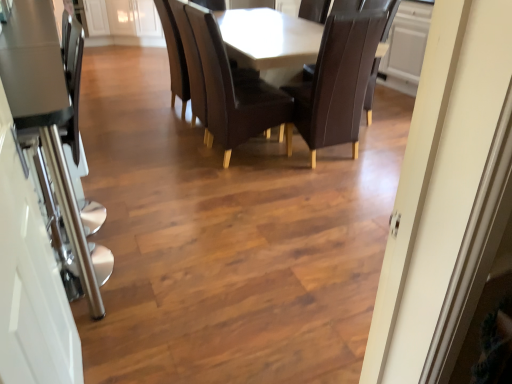
Describe the element at coordinates (233, 90) in the screenshot. I see `leather at center, the first chair positioned from the left` at that location.

This screenshot has height=384, width=512. Find the location of `clear glass door at left`. clear glass door at left is located at coordinates click(x=31, y=288).

Does leather at center, the first chair positioned from the left, turn towards clear glass door at left?

No, leather at center, the first chair positioned from the left, is not turned towards clear glass door at left.

Considering their positions, is leather at center, which is counted as the second chair, starting from the right, located in front of or behind clear glass door at left?

In the image, leather at center, which is counted as the second chair, starting from the right, appears behind clear glass door at left.

From a real-world perspective, is leather at center, the first chair positioned from the left, beneath clear glass door at left?

Yes.

Based on the photo, can you tell me how much leather at center, which is counted as the second chair, starting from the right, and clear glass door at left differ in facing direction?

They differ by 3.49 degrees in their facing directions.

From the image's perspective, which one is positioned lower, leather at center, which is counted as the second chair, starting from the right, or matte brown table at center?

From the image's view, leather at center, which is counted as the second chair, starting from the right, is below.

Consider the image. Which is more to the right, leather at center, the first chair positioned from the left, or matte brown table at center?

matte brown table at center.

Is point (268, 114) positioned after point (278, 109)?

No, (268, 114) is in front of (278, 109).

Is clear glass door at left smaller than leather at center, which is counted as the second chair, starting from the right?

Indeed, clear glass door at left has a smaller size compared to leather at center, which is counted as the second chair, starting from the right.

Does point (9, 263) come closer to viewer compared to point (214, 21)?

Yes, it is.

From a real-world perspective, who is located higher, clear glass door at left or leather at center, which is counted as the second chair, starting from the right?

clear glass door at left.

In the scene shown: Can you see clear glass door at left touching leather at center, the first chair positioned from the left?

There is a gap between clear glass door at left and leather at center, the first chair positioned from the left.

Consider the image. Considering the sizes of objects dark brown leather chair at center, which ranks as the second chair in left-to-right order, and leather at center, the first chair positioned from the left, in the image provided, who is wider, dark brown leather chair at center, which ranks as the second chair in left-to-right order, or leather at center, the first chair positioned from the left,?

leather at center, the first chair positioned from the left, is wider.

I want to click on chair below the dark brown leather chair at center, which appears as the first chair when viewed from the right (from the image's perspective), so click(233, 90).

Are dark brown leather chair at center, which ranks as the second chair in left-to-right order, and leather at center, the first chair positioned from the left, far apart?

Actually, dark brown leather chair at center, which ranks as the second chair in left-to-right order, and leather at center, the first chair positioned from the left, are a little close together.

From a real-world perspective, who is located higher, dark brown leather chair at center, which ranks as the second chair in left-to-right order, or leather at center, which is counted as the second chair, starting from the right?

leather at center, which is counted as the second chair, starting from the right, from a real-world perspective.

Is dark brown leather chair at center, which ranks as the second chair in left-to-right order, turned away from matte brown table at center?

Absolutely, dark brown leather chair at center, which ranks as the second chair in left-to-right order, is directed away from matte brown table at center.

Is dark brown leather chair at center, which ranks as the second chair in left-to-right order, located outside matte brown table at center?

No, dark brown leather chair at center, which ranks as the second chair in left-to-right order, is inside or overlapping with matte brown table at center.

From a real-world perspective, is dark brown leather chair at center, which ranks as the second chair in left-to-right order, over matte brown table at center?

Indeed, from a real-world perspective, dark brown leather chair at center, which ranks as the second chair in left-to-right order, stands above matte brown table at center.

From the image's perspective, which one is positioned higher, dark brown leather chair at center, which ranks as the second chair in left-to-right order, or matte brown table at center?

From the image's view, matte brown table at center is above.

Between clear glass door at left and dark brown leather chair at center, which appears as the first chair when viewed from the right, which one appears on the right side from the viewer's perspective?

From the viewer's perspective, dark brown leather chair at center, which appears as the first chair when viewed from the right, appears more on the right side.

From the image's perspective, does clear glass door at left appear higher than dark brown leather chair at center, which appears as the first chair when viewed from the right?

No, from the image's perspective, clear glass door at left is not over dark brown leather chair at center, which appears as the first chair when viewed from the right.

Where is `glass door on the left of dark brown leather chair at center, which appears as the first chair when viewed from the right`? This screenshot has width=512, height=384. glass door on the left of dark brown leather chair at center, which appears as the first chair when viewed from the right is located at coordinates (31, 288).

Who is smaller, clear glass door at left or dark brown leather chair at center, which ranks as the second chair in left-to-right order?

clear glass door at left is smaller.

Does matte brown table at center lie behind dark brown leather chair at center, which ranks as the second chair in left-to-right order?

Yes, it is behind dark brown leather chair at center, which ranks as the second chair in left-to-right order.

From the image's perspective, does matte brown table at center appear lower than dark brown leather chair at center, which ranks as the second chair in left-to-right order?

No, from the image's perspective, matte brown table at center is not beneath dark brown leather chair at center, which ranks as the second chair in left-to-right order.

From a real-world perspective, who is located lower, matte brown table at center or dark brown leather chair at center, which appears as the first chair when viewed from the right?

matte brown table at center, from a real-world perspective.

Does point (182, 43) come closer to viewer compared to point (288, 134)?

Yes, point (182, 43) is closer to viewer.

This screenshot has height=384, width=512. I want to click on glass door located above the leather at center, the first chair positioned from the left (from a real-world perspective), so click(31, 288).

Where is `kitchen & dining room table lying on the right of leather at center, which is counted as the second chair, starting from the right`? The width and height of the screenshot is (512, 384). kitchen & dining room table lying on the right of leather at center, which is counted as the second chair, starting from the right is located at coordinates (223, 76).

Which object lies further to the anchor point matte brown table at center, clear glass door at left or leather at center, the first chair positioned from the left?

Based on the image, clear glass door at left appears to be further to matte brown table at center.

Looking at the image, which one is located closer to clear glass door at left, dark brown leather chair at center, which appears as the first chair when viewed from the right, or matte brown table at center?

Among the two, matte brown table at center is located nearer to clear glass door at left.

When comparing their distances from leather at center, the first chair positioned from the left, does matte brown table at center or clear glass door at left seem closer?

matte brown table at center is positioned closer to the anchor leather at center, the first chair positioned from the left.

From the image, which object appears to be nearer to leather at center, the first chair positioned from the left, matte brown table at center or dark brown leather chair at center, which appears as the first chair when viewed from the right?

matte brown table at center lies closer to leather at center, the first chair positioned from the left, than the other object.

Considering their positions, is clear glass door at left positioned further to leather at center, which is counted as the second chair, starting from the right, than dark brown leather chair at center, which ranks as the second chair in left-to-right order?

clear glass door at left.

Estimate the real-world distances between objects in this image. Which object is further from clear glass door at left, matte brown table at center or leather at center, which is counted as the second chair, starting from the right?

matte brown table at center.

Considering their positions, is clear glass door at left positioned closer to dark brown leather chair at center, which appears as the first chair when viewed from the right, than matte brown table at center?

The object closer to dark brown leather chair at center, which appears as the first chair when viewed from the right, is matte brown table at center.

Considering their positions, is leather at center, which is counted as the second chair, starting from the right, positioned further to dark brown leather chair at center, which appears as the first chair when viewed from the right, than matte brown table at center?

Among the two, matte brown table at center is located further to dark brown leather chair at center, which appears as the first chair when viewed from the right.

The width and height of the screenshot is (512, 384). What are the coordinates of `kitchen & dining room table between leather at center, which is counted as the second chair, starting from the right, and dark brown leather chair at center, which appears as the first chair when viewed from the right` in the screenshot? It's located at (223, 76).

Locate an element on the screen. chair between clear glass door at left and leather at center, which is counted as the second chair, starting from the right, from front to back is located at coordinates (337, 82).